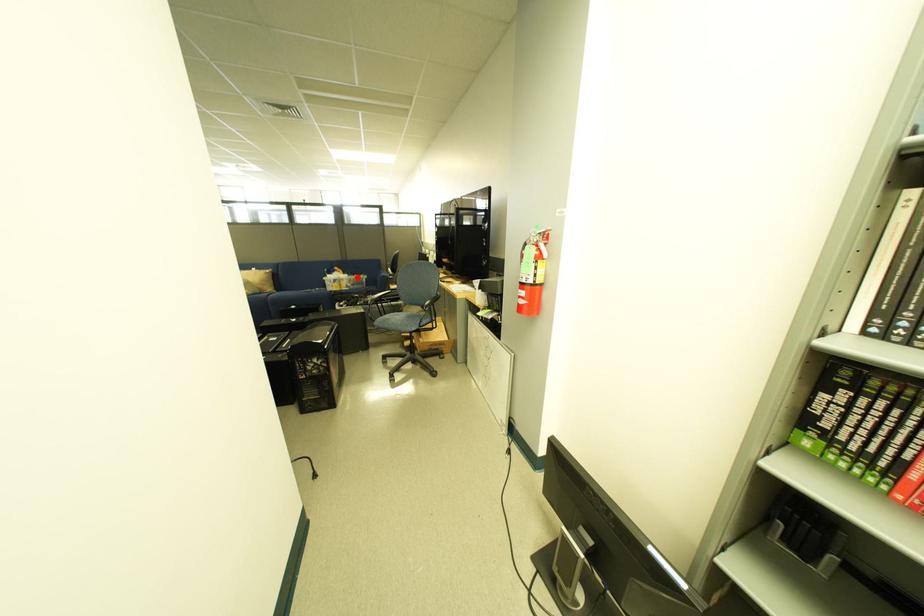
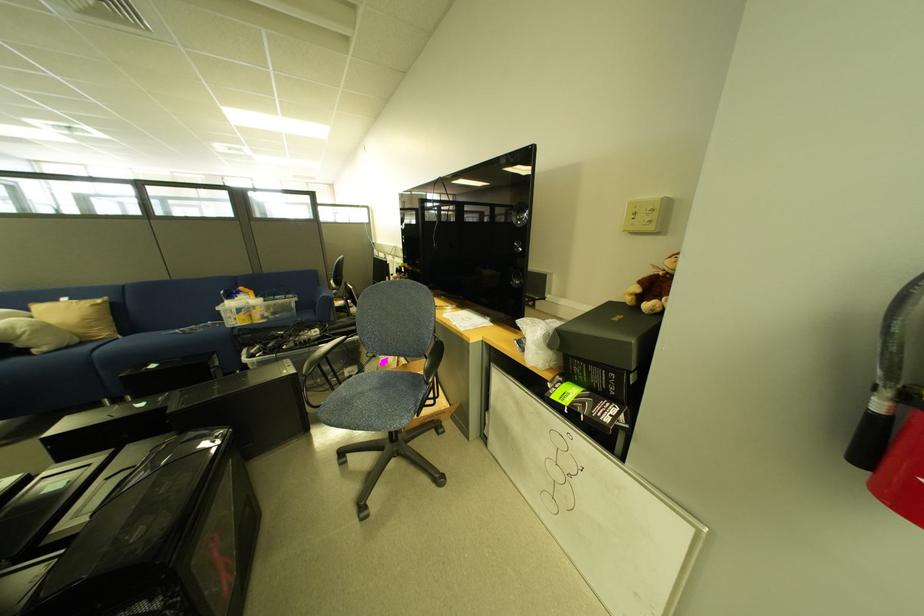
Question: I am providing you with two images of the same scene from different viewpoints. Given a red point in image1, look at the same physical point in image2. Is it:

Choices:
 (A) Closer to the viewpoint
 (B) Farther from the viewpoint

Answer: (B)